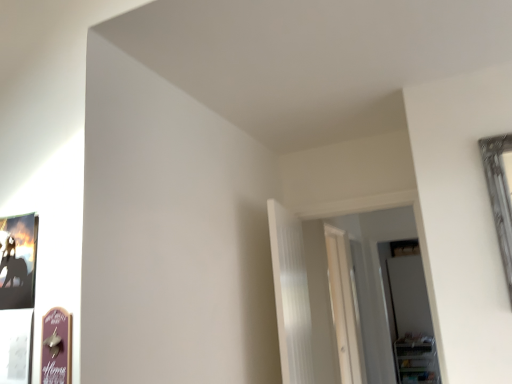
Question: Does clear plastic shelf at lower right appear on the right side of transparent glass door at right, the second glass door when ordered from front to back?

Choices:
 (A) no
 (B) yes

Answer: (B)

Question: Can you confirm if clear plastic shelf at lower right is positioned to the left of transparent glass door at right, which is the 1th glass door from right to left?

Choices:
 (A) yes
 (B) no

Answer: (B)

Question: Considering the relative sizes of clear plastic shelf at lower right and transparent glass door at right, which ranks as the 2th glass door in left-to-right order, in the image provided, is clear plastic shelf at lower right wider than transparent glass door at right, which ranks as the 2th glass door in left-to-right order,?

Choices:
 (A) yes
 (B) no

Answer: (A)

Question: From a real-world perspective, is clear plastic shelf at lower right on transparent glass door at right, the second glass door when ordered from front to back?

Choices:
 (A) no
 (B) yes

Answer: (A)

Question: Is clear plastic shelf at lower right not inside transparent glass door at right, the second glass door when ordered from front to back?

Choices:
 (A) yes
 (B) no

Answer: (A)

Question: Is the depth of clear plastic shelf at lower right greater than that of transparent glass door at right, the second glass door when ordered from front to back?

Choices:
 (A) no
 (B) yes

Answer: (B)

Question: From the image's perspective, does wooden sign at lower left appear higher than white ribbed curtain at center?

Choices:
 (A) no
 (B) yes

Answer: (B)

Question: Can you confirm if wooden sign at lower left is wider than white ribbed curtain at center?

Choices:
 (A) yes
 (B) no

Answer: (B)

Question: Is wooden sign at lower left far from white ribbed curtain at center?

Choices:
 (A) no
 (B) yes

Answer: (B)

Question: Can white ribbed curtain at center be found inside wooden sign at lower left?

Choices:
 (A) yes
 (B) no

Answer: (B)

Question: Can you confirm if wooden sign at lower left is taller than white ribbed curtain at center?

Choices:
 (A) no
 (B) yes

Answer: (A)

Question: Does wooden sign at lower left come behind white ribbed curtain at center?

Choices:
 (A) yes
 (B) no

Answer: (B)

Question: Does transparent glass door at right, the 1th glass door from the back, have a smaller size compared to transparent glass door at center, which appears as the second glass door when viewed from the right?

Choices:
 (A) yes
 (B) no

Answer: (A)